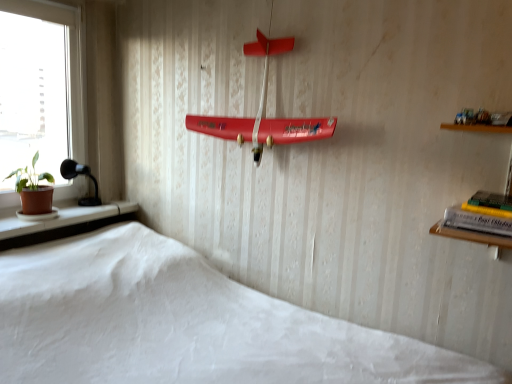
Question: Do you think hardcover book at right is within black glass lamp at left, or outside of it?

Choices:
 (A) outside
 (B) inside

Answer: (A)

Question: From a real-world perspective, relative to black glass lamp at left, is hardcover book at right vertically above or below?

Choices:
 (A) below
 (B) above

Answer: (B)

Question: Estimate the real-world distances between objects in this image. Which object is farther from the black glass lamp at left?

Choices:
 (A) white matte bed at lower center
 (B) terracotta clay pot at left
 (C) green matte houseplant at left
 (D) hardcover book at right

Answer: (D)

Question: Estimate the real-world distances between objects in this image. Which object is farther from the black glass lamp at left?

Choices:
 (A) green matte houseplant at left
 (B) white matte bed at lower center
 (C) terracotta clay pot at left
 (D) hardcover book at right

Answer: (D)